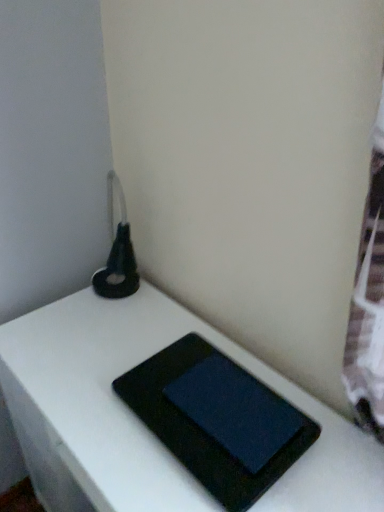
Identify the location of free space to the back side of black matte tablet at center, placed as the 1th tablet computer when sorted from bottom to top. [x=166, y=329].